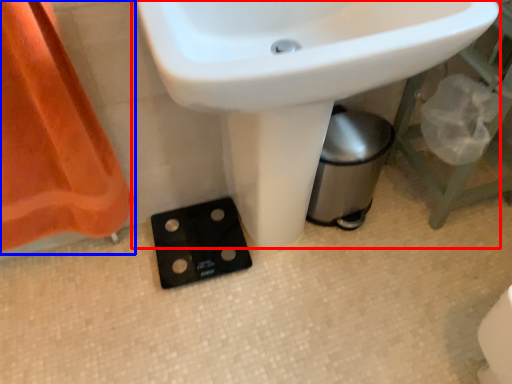
Question: Which object is further to the camera taking this photo, sink (highlighted by a red box) or curtain (highlighted by a blue box)?

Choices:
 (A) sink
 (B) curtain

Answer: (B)